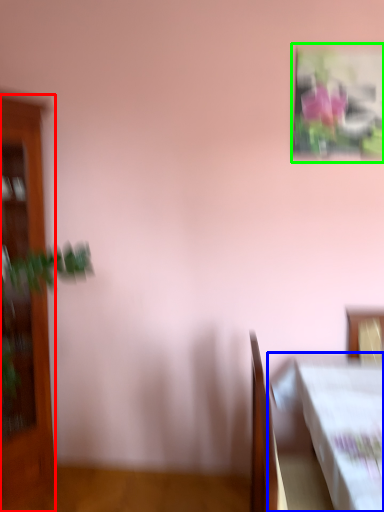
Question: Which object is the farthest from furniture (highlighted by a red box)? Choose among these: table (highlighted by a blue box) or picture frame (highlighted by a green box).

Choices:
 (A) table
 (B) picture frame

Answer: (B)